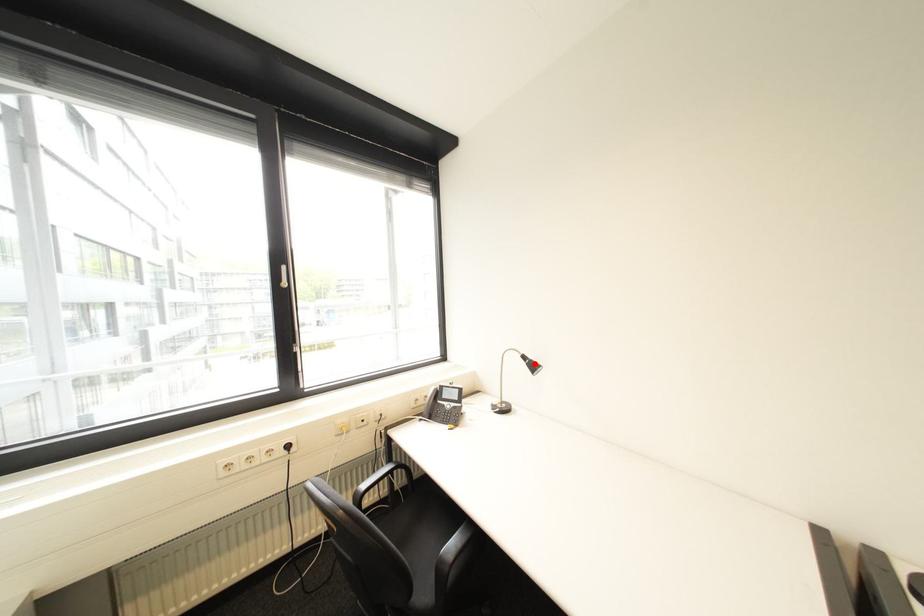
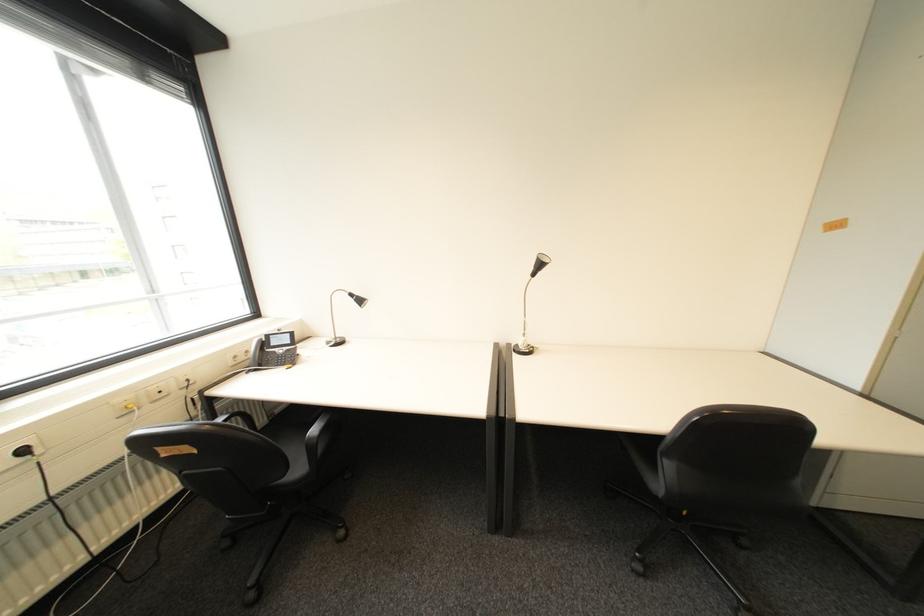
Locate, in the second image, the point that corresponds to the highlighted location in the first image.

(362, 301)